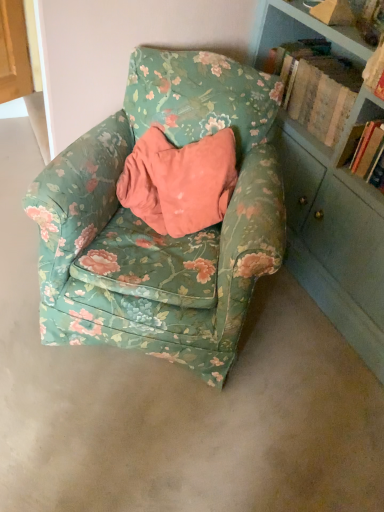
You are a GUI agent. You are given a task and a screenshot of the screen. Output one action in this format:
    pyautogui.click(x=<x>, y=<y>)
    Task: Click on the floral fabric armchair at center
    This screenshot has width=384, height=512.
    Given the screenshot: What is the action you would take?
    pyautogui.click(x=153, y=230)

What is the approximate height of wooden book at upper right, positioned as the 2th book in bottom-to-top order?

wooden book at upper right, positioned as the 2th book in bottom-to-top order, is 10.14 inches tall.

I want to click on floral fabric armchair at center, so click(153, 230).

Is wooden book at upper right, the first book from the top, far away from hardcover book at right, positioned as the 1th book in bottom-to-top order?

No, wooden book at upper right, the first book from the top, is in close proximity to hardcover book at right, positioned as the 1th book in bottom-to-top order.

From the picture: Is wooden book at upper right, the first book from the top, turned away from hardcover book at right, acting as the 2th book starting from the top?

wooden book at upper right, the first book from the top, does not have its back to hardcover book at right, acting as the 2th book starting from the top.

Can you tell me how much wooden book at upper right, the first book from the top, and hardcover book at right, positioned as the 1th book in bottom-to-top order, differ in facing direction?

The facing directions of wooden book at upper right, the first book from the top, and hardcover book at right, positioned as the 1th book in bottom-to-top order, are 1.58 degrees apart.

Does wooden book at upper right, positioned as the 2th book in bottom-to-top order, have a greater height compared to hardcover book at right, acting as the 2th book starting from the top?

In fact, wooden book at upper right, positioned as the 2th book in bottom-to-top order, may be shorter than hardcover book at right, acting as the 2th book starting from the top.

Considering their positions, is floral fabric armchair at center located in front of or behind wooden book at upper right, positioned as the 2th book in bottom-to-top order?

In the image, floral fabric armchair at center appears in front of wooden book at upper right, positioned as the 2th book in bottom-to-top order.

Does point (66, 202) appear closer or farther from the camera than point (318, 117)?

Point (66, 202) is positioned closer to the camera compared to point (318, 117).

From a real-world perspective, who is located higher, floral fabric armchair at center or wooden book at upper right, positioned as the 2th book in bottom-to-top order?

In real-world perspective, wooden book at upper right, positioned as the 2th book in bottom-to-top order, is above.

Which object is thinner, hardcover book at right, positioned as the 1th book in bottom-to-top order, or floral fabric armchair at center?

hardcover book at right, positioned as the 1th book in bottom-to-top order.

Is point (372, 163) positioned before point (255, 277)?

No, (372, 163) is further to viewer.

Is hardcover book at right, positioned as the 1th book in bottom-to-top order, facing away from floral fabric armchair at center?

That's not correct — hardcover book at right, positioned as the 1th book in bottom-to-top order, is not looking away from floral fabric armchair at center.

Between hardcover book at right, acting as the 2th book starting from the top, and floral fabric armchair at center, which one has less height?

hardcover book at right, acting as the 2th book starting from the top, is shorter.

Is wooden book at upper right, the first book from the top, wider or thinner than floral fabric armchair at center?

Considering their sizes, wooden book at upper right, the first book from the top, looks slimmer than floral fabric armchair at center.

Based on their sizes in the image, would you say wooden book at upper right, positioned as the 2th book in bottom-to-top order, is bigger or smaller than floral fabric armchair at center?

Clearly, wooden book at upper right, positioned as the 2th book in bottom-to-top order, is smaller in size than floral fabric armchair at center.

In the scene shown: Are wooden book at upper right, the first book from the top, and floral fabric armchair at center far apart?

No, wooden book at upper right, the first book from the top, is in close proximity to floral fabric armchair at center.

How many degrees apart are the facing directions of wooden book at upper right, positioned as the 2th book in bottom-to-top order, and floral fabric armchair at center?

There is a 55-degree angle between the facing directions of wooden book at upper right, positioned as the 2th book in bottom-to-top order, and floral fabric armchair at center.

Can you see hardcover book at right, acting as the 2th book starting from the top, touching wooden book at upper right, positioned as the 2th book in bottom-to-top order?

hardcover book at right, acting as the 2th book starting from the top, and wooden book at upper right, positioned as the 2th book in bottom-to-top order, are not in contact.

Can you confirm if hardcover book at right, positioned as the 1th book in bottom-to-top order, is wider than wooden book at upper right, positioned as the 2th book in bottom-to-top order?

In fact, hardcover book at right, positioned as the 1th book in bottom-to-top order, might be narrower than wooden book at upper right, positioned as the 2th book in bottom-to-top order.

From a real-world perspective, is hardcover book at right, positioned as the 1th book in bottom-to-top order, located beneath wooden book at upper right, the first book from the top?

No, from a real-world perspective, hardcover book at right, positioned as the 1th book in bottom-to-top order, is not under wooden book at upper right, the first book from the top.

Consider the image. Is floral fabric armchair at center completely or partially outside of hardcover book at right, acting as the 2th book starting from the top?

Indeed, floral fabric armchair at center is completely outside hardcover book at right, acting as the 2th book starting from the top.

Which is closer, (185, 272) or (370, 154)?

Point (185, 272).

From the image's perspective, which is below, floral fabric armchair at center or hardcover book at right, acting as the 2th book starting from the top?

floral fabric armchair at center is shown below in the image.

This screenshot has height=512, width=384. I want to click on chair below the hardcover book at right, positioned as the 1th book in bottom-to-top order (from a real-world perspective), so click(x=153, y=230).

What are the coordinates of `book that appears below the hardcover book at right, positioned as the 1th book in bottom-to-top order (from a real-world perspective)` in the screenshot? It's located at (317, 87).

Identify the location of the 1st book positioned above the floral fabric armchair at center (from a real-world perspective). (317, 87).

When comparing their distances from wooden book at upper right, positioned as the 2th book in bottom-to-top order, does floral fabric armchair at center or hardcover book at right, positioned as the 1th book in bottom-to-top order, seem further?

Among the two, floral fabric armchair at center is located further to wooden book at upper right, positioned as the 2th book in bottom-to-top order.

When comparing their distances from wooden book at upper right, the first book from the top, does hardcover book at right, acting as the 2th book starting from the top, or floral fabric armchair at center seem further?

floral fabric armchair at center.

Which object lies further to the anchor point floral fabric armchair at center, wooden book at upper right, positioned as the 2th book in bottom-to-top order, or hardcover book at right, acting as the 2th book starting from the top?

Among the two, hardcover book at right, acting as the 2th book starting from the top, is located further to floral fabric armchair at center.

From the image, which object appears to be nearer to floral fabric armchair at center, hardcover book at right, acting as the 2th book starting from the top, or wooden book at upper right, positioned as the 2th book in bottom-to-top order?

The object closer to floral fabric armchair at center is wooden book at upper right, positioned as the 2th book in bottom-to-top order.

Based on their spatial positions, is floral fabric armchair at center or wooden book at upper right, positioned as the 2th book in bottom-to-top order, closer to hardcover book at right, acting as the 2th book starting from the top?

The object closer to hardcover book at right, acting as the 2th book starting from the top, is wooden book at upper right, positioned as the 2th book in bottom-to-top order.

Which object lies further to the anchor point hardcover book at right, acting as the 2th book starting from the top, wooden book at upper right, the first book from the top, or floral fabric armchair at center?

Based on the image, floral fabric armchair at center appears to be further to hardcover book at right, acting as the 2th book starting from the top.

Find the location of `book between floral fabric armchair at center and hardcover book at right, positioned as the 1th book in bottom-to-top order`. book between floral fabric armchair at center and hardcover book at right, positioned as the 1th book in bottom-to-top order is located at coordinates (317, 87).